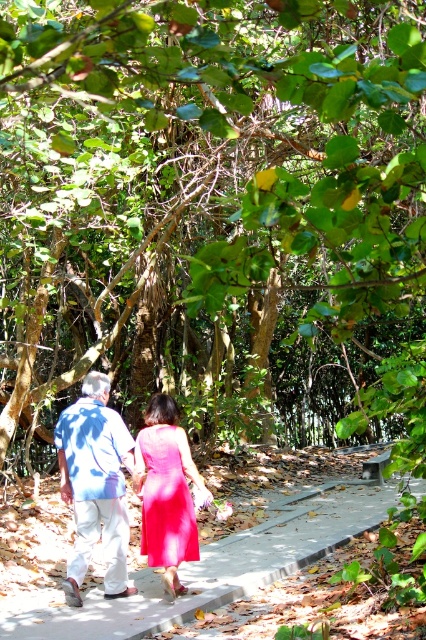
Is blue cotton shirt at center further to the viewer compared to matte pink dress at center?

No, it is not.

Who is lower down, blue cotton shirt at center or matte pink dress at center?

Positioned lower is matte pink dress at center.

Who is more distant from viewer, [126,536] or [172,504]?

Positioned behind is point [126,536].

This screenshot has height=640, width=426. I want to click on blue cotton shirt at center, so pos(94,484).

Can you confirm if gray concrete pavement at center is positioned below matte pink dress at center?

Correct, gray concrete pavement at center is located below matte pink dress at center.

Is point (152, 616) positioned behind point (163, 541)?

That is False.

Find the location of `gray concrete pavement at center`. gray concrete pavement at center is located at coordinates (213, 568).

Which is more to the left, gray concrete pavement at center or blue cotton shirt at center?

blue cotton shirt at center

Find the location of a particular element. This screenshot has height=640, width=426. gray concrete pavement at center is located at coordinates (213, 568).